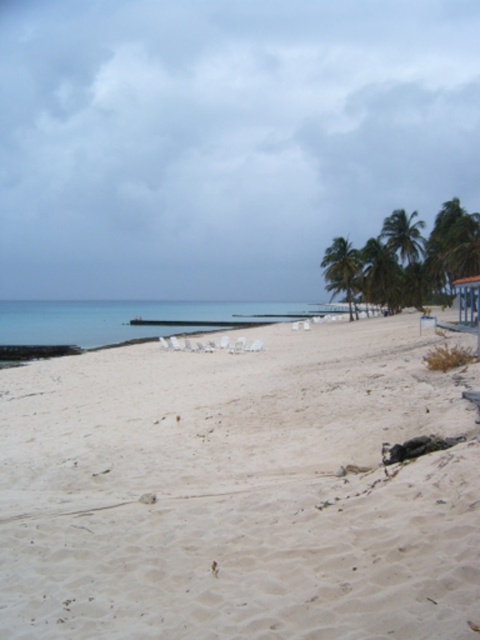
Question: Can you confirm if blue water at center is positioned above green leafy palm tree at upper right?

Choices:
 (A) yes
 (B) no

Answer: (B)

Question: Which point is farther to the camera?

Choices:
 (A) blue water at center
 (B) green leafy palm tree at right

Answer: (B)

Question: Can you confirm if white sandy beach at lower left is positioned to the left of green leafy palm tree at center-right?

Choices:
 (A) yes
 (B) no

Answer: (A)

Question: Which object is farther from the camera taking this photo?

Choices:
 (A) white sandy beach at lower left
 (B) green leafy palm tree at upper right

Answer: (B)

Question: Which object appears farthest from the camera in this image?

Choices:
 (A) white sandy beach at lower left
 (B) green leafy palm tree at right

Answer: (B)

Question: Is green leafy palm tree at center-right closer to the viewer compared to green leafy palm tree at upper right?

Choices:
 (A) no
 (B) yes

Answer: (B)